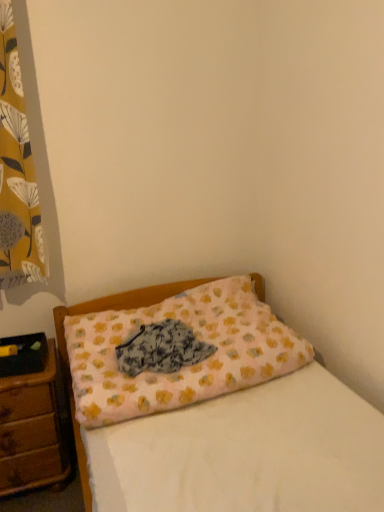
Image resolution: width=384 pixels, height=512 pixels. What are the coordinates of `fluffy fabric at center` in the screenshot? It's located at [x=161, y=349].

Describe the element at coordinates (161, 349) in the screenshot. I see `fluffy fabric at center` at that location.

Find the location of a particular element. brown wooden nightstand at lower left is located at coordinates (31, 431).

Is fluffy fabric at center not within pink fabric pillow at center?

That's incorrect, fluffy fabric at center is not completely outside pink fabric pillow at center.

Locate an element on the screen. Image resolution: width=384 pixels, height=512 pixels. material below the pink fabric pillow at center (from the image's perspective) is located at coordinates (161, 349).

Does point (135, 372) lie in front of point (173, 396)?

No, it is behind (173, 396).

Who is smaller, brown wooden nightstand at lower left or yellow floral fabric at left?

Smaller between the two is yellow floral fabric at left.

Between brown wooden nightstand at lower left and yellow floral fabric at left, which one appears on the left side from the viewer's perspective?

Positioned to the left is yellow floral fabric at left.

From a real-world perspective, is brown wooden nightstand at lower left positioned above or below yellow floral fabric at left?

brown wooden nightstand at lower left is situated lower than yellow floral fabric at left in the real world.

How many degrees apart are the facing directions of brown wooden nightstand at lower left and yellow floral fabric at left?

They differ by 0.877 degrees in their facing directions.

Consider the image. Which object is further away from the camera taking this photo, yellow floral fabric at left or fluffy fabric at center?

fluffy fabric at center is more distant.

Is fluffy fabric at center located within yellow floral fabric at left?

No.

What are the coordinates of `curtain on the left of the fluffy fabric at center` in the screenshot? It's located at 17,172.

Measure the distance between pink fabric pillow at center and brown wooden nightstand at lower left.

pink fabric pillow at center and brown wooden nightstand at lower left are 17.55 inches apart from each other.

In the image, there is a pink fabric pillow at center. Where is `nightstand below it (from a real-world perspective)`? The image size is (384, 512). nightstand below it (from a real-world perspective) is located at coordinates (31, 431).

In the scene shown: Which is more to the right, pink fabric pillow at center or brown wooden nightstand at lower left?

pink fabric pillow at center.

In the scene shown: Is pink fabric pillow at center beside brown wooden nightstand at lower left?

There is a gap between pink fabric pillow at center and brown wooden nightstand at lower left.

Is pink fabric pillow at center directly adjacent to yellow floral fabric at left?

No, pink fabric pillow at center is not beside yellow floral fabric at left.

Is pink fabric pillow at center to the right of yellow floral fabric at left from the viewer's perspective?

Correct, you'll find pink fabric pillow at center to the right of yellow floral fabric at left.

From the image's perspective, is pink fabric pillow at center positioned above or below yellow floral fabric at left?

Based on their image positions, pink fabric pillow at center is located beneath yellow floral fabric at left.

Does point (77, 322) come in front of point (28, 274)?

No.

From the image's perspective, does yellow floral fabric at left appear lower than brown wooden nightstand at lower left?

No, from the image's perspective, yellow floral fabric at left is not beneath brown wooden nightstand at lower left.

Is yellow floral fabric at left touching brown wooden nightstand at lower left?

No, yellow floral fabric at left is not touching brown wooden nightstand at lower left.

Is yellow floral fabric at left turned away from brown wooden nightstand at lower left?

No, brown wooden nightstand at lower left is not at the back of yellow floral fabric at left.

Is brown wooden nightstand at lower left closer to the viewer compared to fluffy fabric at center?

No.

Based on the photo, is brown wooden nightstand at lower left facing away from fluffy fabric at center?

brown wooden nightstand at lower left is not turned away from fluffy fabric at center.

Where is `material in front of the brown wooden nightstand at lower left`? This screenshot has height=512, width=384. material in front of the brown wooden nightstand at lower left is located at coordinates (161, 349).

Locate an element on the screen. The width and height of the screenshot is (384, 512). material above the pink fabric pillow at center (from a real-world perspective) is located at coordinates (161, 349).

You are a GUI agent. You are given a task and a screenshot of the screen. Output one action in this format:
    pyautogui.click(x=<x>, y=<y>)
    Task: Click on the nightstand below the yellow floral fabric at left (from a real-world perspective)
    This screenshot has height=512, width=384.
    Given the screenshot: What is the action you would take?
    pyautogui.click(x=31, y=431)

When comparing their distances from brown wooden nightstand at lower left, does yellow floral fabric at left or fluffy fabric at center seem closer?

The object closer to brown wooden nightstand at lower left is fluffy fabric at center.

Based on their spatial positions, is brown wooden nightstand at lower left or yellow floral fabric at left further from fluffy fabric at center?

yellow floral fabric at left lies further to fluffy fabric at center than the other object.

Which object lies nearer to the anchor point brown wooden nightstand at lower left, pink fabric pillow at center or yellow floral fabric at left?

pink fabric pillow at center.

From the image, which object appears to be nearer to brown wooden nightstand at lower left, pink fabric pillow at center or fluffy fabric at center?

pink fabric pillow at center is positioned closer to the anchor brown wooden nightstand at lower left.

When comparing their distances from yellow floral fabric at left, does brown wooden nightstand at lower left or fluffy fabric at center seem closer?

Among the two, brown wooden nightstand at lower left is located nearer to yellow floral fabric at left.

Looking at the image, which one is located further to yellow floral fabric at left, fluffy fabric at center or pink fabric pillow at center?

The object further to yellow floral fabric at left is fluffy fabric at center.

Considering their positions, is yellow floral fabric at left positioned further to brown wooden nightstand at lower left than pink fabric pillow at center?

The object further to brown wooden nightstand at lower left is yellow floral fabric at left.

Estimate the real-world distances between objects in this image. Which object is closer to yellow floral fabric at left, pink fabric pillow at center or brown wooden nightstand at lower left?

pink fabric pillow at center.

Image resolution: width=384 pixels, height=512 pixels. Find the location of `pillow between yellow floral fabric at left and brown wooden nightstand at lower left vertically`. pillow between yellow floral fabric at left and brown wooden nightstand at lower left vertically is located at coordinates (183, 367).

You are a GUI agent. You are given a task and a screenshot of the screen. Output one action in this format:
    pyautogui.click(x=<x>, y=<y>)
    Task: Click on the pillow between yellow floral fabric at left and fluffy fabric at center vertically
    The image size is (384, 512).
    Given the screenshot: What is the action you would take?
    pyautogui.click(x=183, y=367)

Where is `material between yellow floral fabric at left and brown wooden nightstand at lower left from top to bottom`? material between yellow floral fabric at left and brown wooden nightstand at lower left from top to bottom is located at coordinates (161, 349).

Identify the location of material located between brown wooden nightstand at lower left and pink fabric pillow at center in the left-right direction. The height and width of the screenshot is (512, 384). (161, 349).